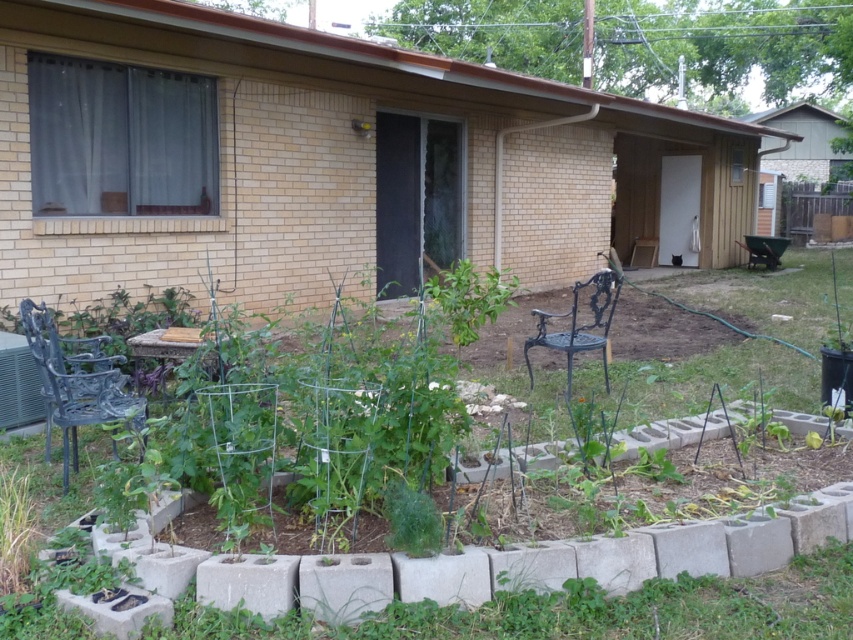
Question: Does green wire trellis at center appear on the left side of black wrought iron chair at center-right?

Choices:
 (A) yes
 (B) no

Answer: (A)

Question: Which of the following is the closest to the observer?

Choices:
 (A) (792, 280)
 (B) (74, 360)
 (C) (608, 300)

Answer: (B)

Question: Does green wire trellis at center appear on the right side of black wrought iron chair at center-right?

Choices:
 (A) no
 (B) yes

Answer: (A)

Question: Can you confirm if matte black chair at left is bigger than black wrought iron chair at center-right?

Choices:
 (A) no
 (B) yes

Answer: (A)

Question: Which is nearer to the matte black chair at left?

Choices:
 (A) black wrought iron chair at center-right
 (B) green wire trellis at center

Answer: (B)

Question: Which of the following is the closest to the observer?

Choices:
 (A) (64, 492)
 (B) (778, 600)

Answer: (B)